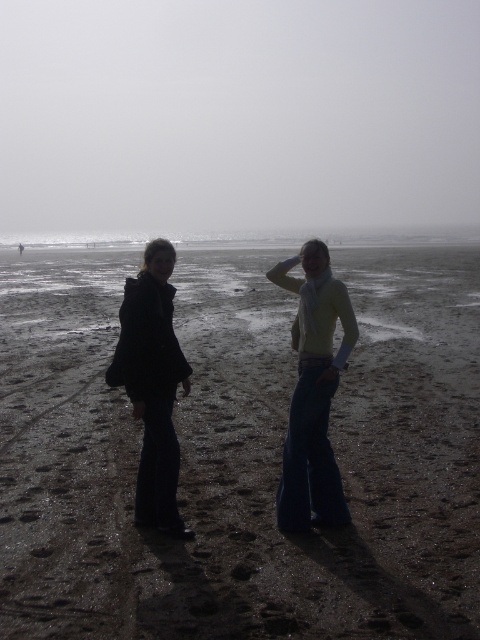
You are a photographer trying to decide where to place a new subject in the photo. The existing subjects are the light yellow sweater at center and the matte black coat at left. If you want the new subject to be taller than both, where should you position them relative to the existing subjects?

The light yellow sweater at center is shorter than the matte black coat at left. To place a new subject taller than both, position them so they are taller than the matte black coat at left, which is already the taller of the two.

You are standing at the beach and want to take a photo of both the point at coordinates point (197, 604) and point (159, 330). Since you want both points to be in focus, which point should you focus on to ensure the other is also sharp?

You should focus on point (159, 330) because it is farther from the camera than point (197, 604). By focusing on the farther point, the closer point will also be within the depth of field, ensuring both are sharp.